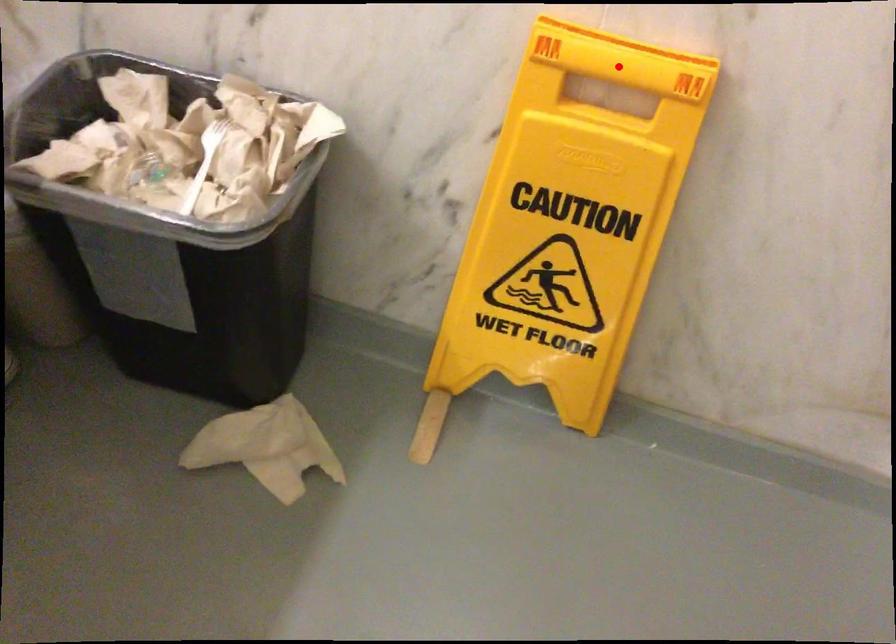
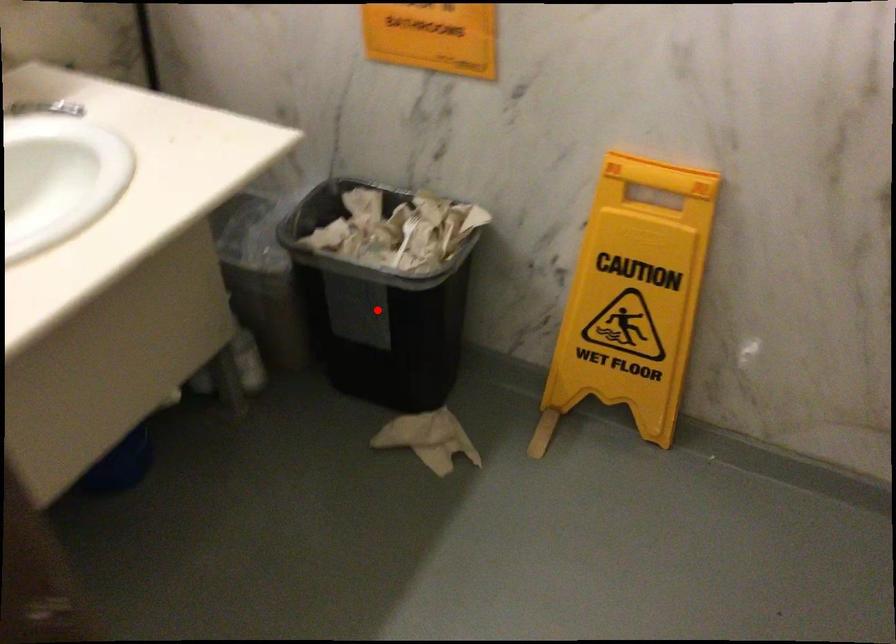
I am providing you with two images of the same scene from different viewpoints. A red point is marked on the first image and another point is marked on the second image. Does the point marked in image1 correspond to the same location as the one in image2?

No